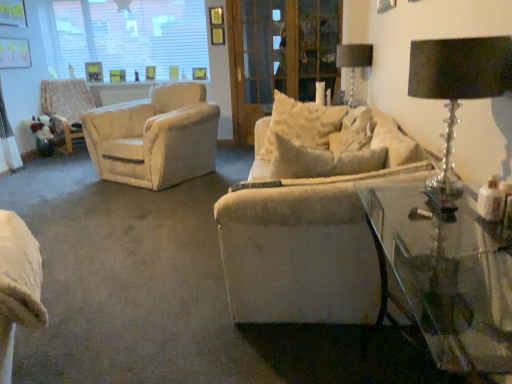
What is the approximate width of white textured chair at left?

The width of white textured chair at left is 33.88 inches.

What is the approximate width of wooden screen door at center?

The width of wooden screen door at center is 4.13 inches.

What is the approximate height of wooden screen door at center?

It is 1.84 meters.

At what (x,y) coordinates should I click in order to perform the action: click on transparent glass table at lower right. Please return your answer as a coordinate pair (x, y). Looking at the image, I should click on (448, 274).

What do you see at coordinates (132, 35) in the screenshot?
I see `transparent glass window at upper left` at bounding box center [132, 35].

Find the location of a particular element. Image resolution: width=512 pixels, height=384 pixels. metallic glass table lamp at upper right, acting as the second table lamp starting from the bottom is located at coordinates (354, 63).

Consider the image. Is metallic glass table lamp at upper right, marked as the 1th table lamp in a top-to-bottom arrangement, inside the boundaries of transparent glass table at lower right, or outside?

The correct answer is: outside.

Which of these two, metallic glass table lamp at upper right, marked as the 1th table lamp in a top-to-bottom arrangement, or transparent glass table at lower right, is thinner?

With smaller width is metallic glass table lamp at upper right, marked as the 1th table lamp in a top-to-bottom arrangement.

Is metallic glass table lamp at upper right, the first table lamp when ordered from back to front, at the right side of transparent glass table at lower right?

Yes, metallic glass table lamp at upper right, the first table lamp when ordered from back to front, is to the right of transparent glass table at lower right.

Which object is closer to the camera, wooden screen door at center or transparent glass table at lower right?

Positioned in front is transparent glass table at lower right.

Could you tell me if wooden screen door at center is turned towards transparent glass table at lower right?

Yes.

Does point (256, 94) appear closer or farther from the camera than point (439, 271)?

Point (256, 94).

What's the angular difference between white textured chair at left and wooden screen door at center's facing directions?

47.3 degrees separate the facing orientations of white textured chair at left and wooden screen door at center.

Between point (47, 105) and point (243, 111), which one is positioned in front?

Positioned in front is point (243, 111).

Between white textured chair at left and wooden screen door at center, which one has smaller width?

wooden screen door at center is thinner.

From a real-world perspective, who is located lower, white textured chair at left or wooden screen door at center?

white textured chair at left, from a real-world perspective.

At what (x,y) coordinates should I click in order to perform the action: click on table in front of the black crystal table lamp at upper right, which appears as the 2th table lamp when viewed from the back. Please return your answer as a coordinate pair (x, y). This screenshot has width=512, height=384. Looking at the image, I should click on (448, 274).

Considering the relative sizes of transparent glass table at lower right and black crystal table lamp at upper right, marked as the 1th table lamp in a bottom-to-top arrangement, in the image provided, is transparent glass table at lower right thinner than black crystal table lamp at upper right, marked as the 1th table lamp in a bottom-to-top arrangement,?

Incorrect, the width of transparent glass table at lower right is not less than that of black crystal table lamp at upper right, marked as the 1th table lamp in a bottom-to-top arrangement.

Is transparent glass table at lower right at the right side of black crystal table lamp at upper right, marked as the 1th table lamp in a bottom-to-top arrangement?

No.

Considering the sizes of transparent glass table at lower right and black crystal table lamp at upper right, arranged as the 2th table lamp when viewed from the top, in the image, is transparent glass table at lower right taller or shorter than black crystal table lamp at upper right, arranged as the 2th table lamp when viewed from the top,?

transparent glass table at lower right is taller than black crystal table lamp at upper right, arranged as the 2th table lamp when viewed from the top.

Is metallic glass table lamp at upper right, marked as the 1th table lamp in a top-to-bottom arrangement, surrounding transparent glass window at upper left?

No, metallic glass table lamp at upper right, marked as the 1th table lamp in a top-to-bottom arrangement, does not contain transparent glass window at upper left.

In terms of size, does metallic glass table lamp at upper right, acting as the second table lamp starting from the bottom, appear bigger or smaller than transparent glass window at upper left?

metallic glass table lamp at upper right, acting as the second table lamp starting from the bottom, is smaller than transparent glass window at upper left.

From a real-world perspective, is metallic glass table lamp at upper right, marked as the 1th table lamp in a top-to-bottom arrangement, on transparent glass window at upper left?

No, from a real-world perspective, metallic glass table lamp at upper right, marked as the 1th table lamp in a top-to-bottom arrangement, is not on top of transparent glass window at upper left.

Is the surface of transparent glass table at lower right in direct contact with metallic glass table lamp at upper right, acting as the second table lamp starting from the bottom?

transparent glass table at lower right and metallic glass table lamp at upper right, acting as the second table lamp starting from the bottom, are not in contact.

Which of these two, transparent glass table at lower right or metallic glass table lamp at upper right, acting as the second table lamp starting from the bottom, is wider?

transparent glass table at lower right is wider.

Between transparent glass table at lower right and metallic glass table lamp at upper right, the first table lamp when ordered from back to front, which one has larger size?

transparent glass table at lower right.

Considering the positions of objects transparent glass table at lower right and metallic glass table lamp at upper right, the first table lamp when ordered from back to front, in the image provided, who is in front, transparent glass table at lower right or metallic glass table lamp at upper right, the first table lamp when ordered from back to front,?

Positioned in front is transparent glass table at lower right.

From the image's perspective, which is below, transparent glass window at upper left or transparent glass table at lower right?

transparent glass table at lower right appears lower in the image.

Considering the relative sizes of transparent glass window at upper left and transparent glass table at lower right in the image provided, is transparent glass window at upper left thinner than transparent glass table at lower right?

Yes.

Is point (193, 40) behind point (424, 293)?

Yes.

Locate an element on the screen. The width and height of the screenshot is (512, 384). table located on the left of metallic glass table lamp at upper right, the first table lamp when ordered from back to front is located at coordinates (448, 274).

Where is `screen door behind the transparent glass table at lower right`? screen door behind the transparent glass table at lower right is located at coordinates (252, 60).

From the picture: Considering their positions, is white textured chair at left positioned further to black crystal table lamp at upper right, the 1th table lamp from the front, than metallic glass table lamp at upper right, marked as the 1th table lamp in a top-to-bottom arrangement?

Based on the image, white textured chair at left appears to be further to black crystal table lamp at upper right, the 1th table lamp from the front.

Considering their positions, is black crystal table lamp at upper right, marked as the 1th table lamp in a bottom-to-top arrangement, positioned closer to wooden screen door at center than metallic glass table lamp at upper right, marked as the 1th table lamp in a top-to-bottom arrangement?

Among the two, metallic glass table lamp at upper right, marked as the 1th table lamp in a top-to-bottom arrangement, is located nearer to wooden screen door at center.

Which object lies further to the anchor point transparent glass window at upper left, metallic glass table lamp at upper right, marked as the 1th table lamp in a top-to-bottom arrangement, or wooden screen door at center?

The object further to transparent glass window at upper left is metallic glass table lamp at upper right, marked as the 1th table lamp in a top-to-bottom arrangement.

Estimate the real-world distances between objects in this image. Which object is closer to white textured chair at left, wooden screen door at center or metallic glass table lamp at upper right, marked as the 1th table lamp in a top-to-bottom arrangement?

Based on the image, wooden screen door at center appears to be nearer to white textured chair at left.

Which object lies nearer to the anchor point transparent glass window at upper left, black crystal table lamp at upper right, the 1th table lamp from the front, or metallic glass table lamp at upper right, marked as the 1th table lamp in a top-to-bottom arrangement?

Among the two, metallic glass table lamp at upper right, marked as the 1th table lamp in a top-to-bottom arrangement, is located nearer to transparent glass window at upper left.

When comparing their distances from metallic glass table lamp at upper right, marked as the second table lamp in a front-to-back arrangement, does transparent glass window at upper left or white textured chair at left seem closer?

transparent glass window at upper left lies closer to metallic glass table lamp at upper right, marked as the second table lamp in a front-to-back arrangement, than the other object.

When comparing their distances from black crystal table lamp at upper right, arranged as the 2th table lamp when viewed from the top, does transparent glass table at lower right or wooden screen door at center seem closer?

transparent glass table at lower right lies closer to black crystal table lamp at upper right, arranged as the 2th table lamp when viewed from the top, than the other object.

Which object lies further to the anchor point transparent glass table at lower right, white textured chair at left or transparent glass window at upper left?

Among the two, transparent glass window at upper left is located further to transparent glass table at lower right.

Locate an element on the screen. table lamp located between black crystal table lamp at upper right, which appears as the 2th table lamp when viewed from the back, and transparent glass window at upper left in the depth direction is located at coordinates (354, 63).

You are a GUI agent. You are given a task and a screenshot of the screen. Output one action in this format:
    pyautogui.click(x=<x>, y=<y>)
    Task: Click on the screen door located between transparent glass table at lower right and white textured chair at left in the depth direction
    This screenshot has width=512, height=384.
    Given the screenshot: What is the action you would take?
    pyautogui.click(x=252, y=60)

The width and height of the screenshot is (512, 384). I want to click on chair between black crystal table lamp at upper right, marked as the 1th table lamp in a bottom-to-top arrangement, and transparent glass window at upper left in the front-back direction, so click(x=66, y=107).

Locate an element on the screen. screen door between transparent glass window at upper left and metallic glass table lamp at upper right, the first table lamp when ordered from back to front, in the horizontal direction is located at coordinates (252, 60).